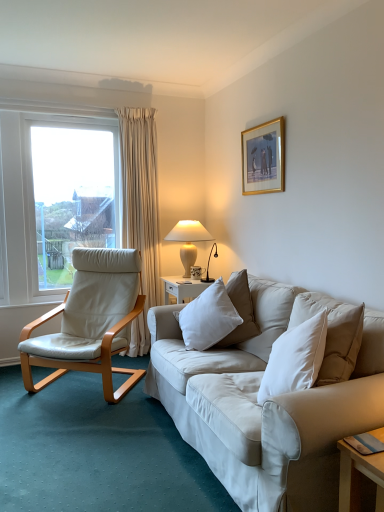
Question: Looking at their shapes, would you say gold/glossy picture frame at upper center is wider or thinner than white ceramic table lamp at upper right?

Choices:
 (A) wide
 (B) thin

Answer: (B)

Question: Is point (261, 152) closer or farther from the camera than point (190, 223)?

Choices:
 (A) closer
 (B) farther

Answer: (A)

Question: Considering the real-world distances, which object is farthest from the white leather chair at left?

Choices:
 (A) white ceramic table lamp at upper right
 (B) white soft pillow at center
 (C) gold/glossy picture frame at upper center

Answer: (C)

Question: Which is nearer to the white ceramic table lamp at upper right?

Choices:
 (A) white soft pillow at center
 (B) gold/glossy picture frame at upper center
 (C) white leather chair at left

Answer: (B)